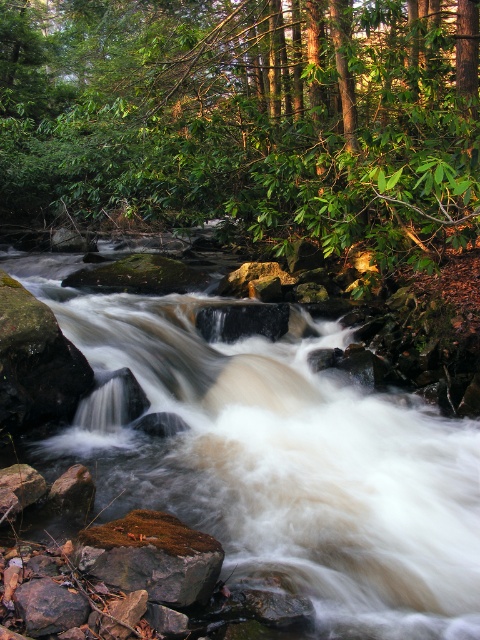
Question: Which point is closer to the camera?

Choices:
 (A) green leafy tree at center
 (B) brown smooth rock at center
 (C) green mossy rock at lower center
 (D) brown rough rock at lower left

Answer: (D)

Question: Among these points, which one is farthest from the camera?

Choices:
 (A) (370, 228)
 (B) (437, 612)

Answer: (A)

Question: Is brown smooth rock at center above brown rough rock at lower left?

Choices:
 (A) yes
 (B) no

Answer: (B)

Question: Is brown smooth rock at center behind brown rough rock at lower left?

Choices:
 (A) yes
 (B) no

Answer: (A)

Question: Can you confirm if green leafy tree at center is smaller than green mossy rock at lower center?

Choices:
 (A) no
 (B) yes

Answer: (A)

Question: Which of the following is the closest to the observer?

Choices:
 (A) brown smooth rock at center
 (B) green mossy rock at lower center
 (C) green leafy tree at center
 (D) brown rough rock at lower left

Answer: (D)